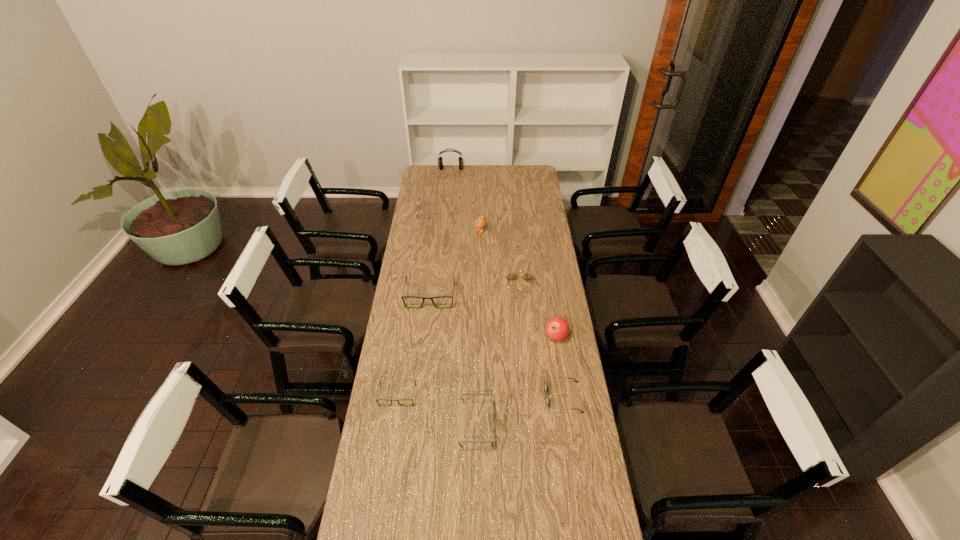
You are a GUI agent. You are given a task and a screenshot of the screen. Output one action in this format:
    pyautogui.click(x=<x>, y=<y>)
    Task: Click on the free spot between the smallest black spectacles and the sunglasses
    The width and height of the screenshot is (960, 540).
    Given the screenshot: What is the action you would take?
    pyautogui.click(x=480, y=396)

At what (x,y) coordinates should I click in order to perform the action: click on free space between the biggest black spectacles and the rightmost black spectacles. Please return your answer as a coordinate pair (x, y). The image size is (960, 540). Looking at the image, I should click on (453, 361).

Where is `vacant area between the farthest spectacles and the nearer yellow spectacles`? The width and height of the screenshot is (960, 540). vacant area between the farthest spectacles and the nearer yellow spectacles is located at coordinates (474, 250).

In order to click on free space between the fourth tallest object and the rightmost black spectacles in this screenshot , I will do `click(453, 361)`.

Where is `empty space between the farthest object and the rightmost spectacles`? empty space between the farthest object and the rightmost spectacles is located at coordinates (486, 228).

You are a GUI agent. You are given a task and a screenshot of the screen. Output one action in this format:
    pyautogui.click(x=<x>, y=<y>)
    Task: Click on the free spot between the teddy bear and the tallest object
    The image size is (960, 540).
    Given the screenshot: What is the action you would take?
    pyautogui.click(x=466, y=200)

You are a GUI agent. You are given a task and a screenshot of the screen. Output one action in this format:
    pyautogui.click(x=<x>, y=<y>)
    Task: Click on the empty space that is in between the tallest spectacles and the rightmost spectacles
    
    Given the screenshot: What is the action you would take?
    pyautogui.click(x=475, y=292)

Locate an element on the screen. free space between the right yellow spectacles and the rightmost black spectacles is located at coordinates (498, 356).

Identify the location of vacant point located between the second farthest object and the fourth tallest object. The image size is (960, 540). (429, 255).

Choose which object is the second nearest neighbor to the tallest object. Please provide its 2D coordinates. Your answer should be formatted as a tuple, i.e. [(x, y)], where the tuple contains the x and y coordinates of a point satisfying the conditions above.

[(480, 222)]